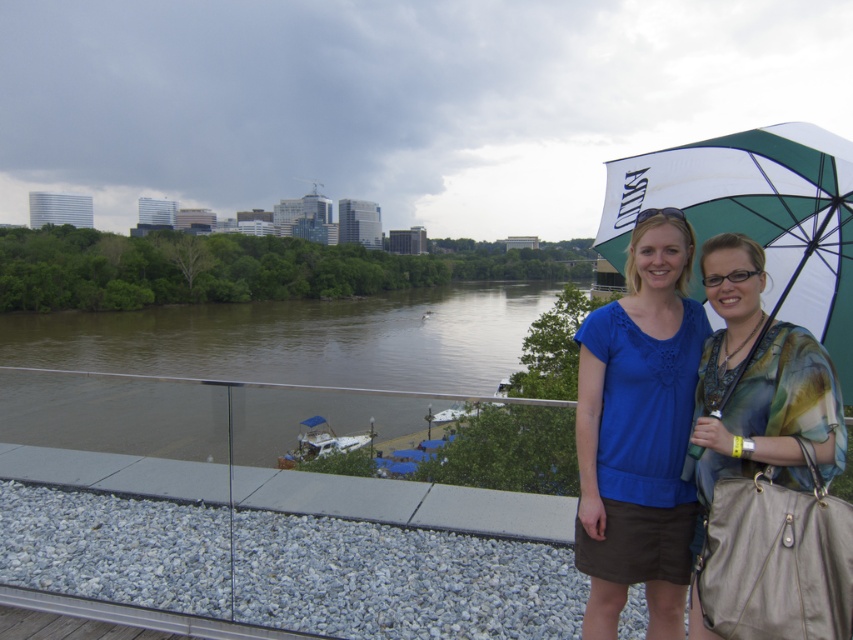
You are a photographer trying to capture the scene with the blue fabric shirt at center and the green and white fabric umbrella at upper right. Which object should you zoom in on to focus on the larger one?

The green and white fabric umbrella at upper right is larger, so you should zoom in on it to focus on the larger object.

You are standing at the point closer to you between the two points, point [605,369] and point [848,156]. Which point are you standing at?

You are standing at point [605,369] because it is closer to the viewer than point [848,156].